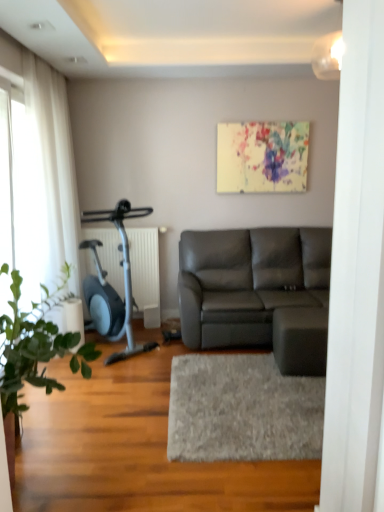
Question: Considering the relative sizes of white sheer curtain at left and matte gray leather couch at center in the image provided, is white sheer curtain at left shorter than matte gray leather couch at center?

Choices:
 (A) yes
 (B) no

Answer: (B)

Question: Can matte gray leather couch at center be found inside white sheer curtain at left?

Choices:
 (A) yes
 (B) no

Answer: (B)

Question: From a real-world perspective, is white sheer curtain at left positioned over matte gray leather couch at center based on gravity?

Choices:
 (A) no
 (B) yes

Answer: (B)

Question: Can you confirm if white sheer curtain at left is smaller than matte gray leather couch at center?

Choices:
 (A) no
 (B) yes

Answer: (B)

Question: Is there a large distance between white sheer curtain at left and matte gray leather couch at center?

Choices:
 (A) yes
 (B) no

Answer: (A)

Question: From the image's perspective, is transparent glass door at left above or below green leafy plant at left?

Choices:
 (A) above
 (B) below

Answer: (A)

Question: In the image, is transparent glass door at left on the left side or the right side of green leafy plant at left?

Choices:
 (A) right
 (B) left

Answer: (B)

Question: In the image, is transparent glass door at left positioned in front of or behind green leafy plant at left?

Choices:
 (A) front
 (B) behind

Answer: (B)

Question: In terms of width, does transparent glass door at left look wider or thinner when compared to green leafy plant at left?

Choices:
 (A) thin
 (B) wide

Answer: (A)

Question: Considering the positions of point (13, 467) and point (112, 220), is point (13, 467) closer or farther from the camera than point (112, 220)?

Choices:
 (A) closer
 (B) farther

Answer: (A)

Question: Choose the correct answer: Is green leafy plant at left inside metallic blue stationary bicycle at left or outside it?

Choices:
 (A) inside
 (B) outside

Answer: (B)

Question: Considering their positions, is green leafy plant at left located in front of or behind metallic blue stationary bicycle at left?

Choices:
 (A) behind
 (B) front

Answer: (B)

Question: Is green leafy plant at left to the left or to the right of metallic blue stationary bicycle at left in the image?

Choices:
 (A) left
 (B) right

Answer: (A)

Question: Is transparent glass door at left wider or thinner than white sheer curtain at left?

Choices:
 (A) wide
 (B) thin

Answer: (B)

Question: Considering the positions of transparent glass door at left and white sheer curtain at left in the image, is transparent glass door at left taller or shorter than white sheer curtain at left?

Choices:
 (A) tall
 (B) short

Answer: (B)